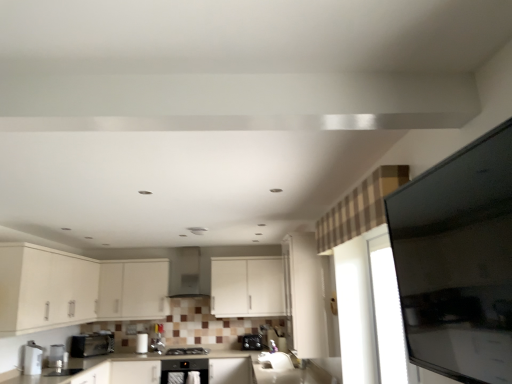
Question: Can you confirm if satin black oven at center, placed as the second home appliance when sorted from top to bottom, is smaller than metallic silver toaster at lower left, the 2th appliance positioned from the left?

Choices:
 (A) yes
 (B) no

Answer: (B)

Question: Considering the relative positions of satin black oven at center, which is the first home appliance in bottom-to-top order, and metallic silver toaster at lower left, positioned as the 4th appliance in back-to-front order, in the image provided, is satin black oven at center, which is the first home appliance in bottom-to-top order, behind metallic silver toaster at lower left, positioned as the 4th appliance in back-to-front order,?

Choices:
 (A) no
 (B) yes

Answer: (B)

Question: Is satin black oven at center, which is the first home appliance from right to left, aimed at metallic silver toaster at lower left, the 4th appliance viewed from the right?

Choices:
 (A) no
 (B) yes

Answer: (A)

Question: Can you confirm if satin black oven at center, placed as the second home appliance when sorted from top to bottom, is wider than metallic silver toaster at lower left, the 2th appliance positioned from the left?

Choices:
 (A) yes
 (B) no

Answer: (A)

Question: From a real-world perspective, is satin black oven at center, which is the first home appliance in bottom-to-top order, positioned under metallic silver toaster at lower left, positioned as the 4th appliance in back-to-front order, based on gravity?

Choices:
 (A) no
 (B) yes

Answer: (B)

Question: From a real-world perspective, is satin black stove at center physically located above or below metallic silver toaster at lower left, marked as the 2th appliance in a front-to-back arrangement?

Choices:
 (A) below
 (B) above

Answer: (A)

Question: Does point (195, 347) appear closer or farther from the camera than point (65, 360)?

Choices:
 (A) closer
 (B) farther

Answer: (B)

Question: Is satin black stove at center wider or thinner than metallic silver toaster at lower left, positioned as the 4th appliance in back-to-front order?

Choices:
 (A) wide
 (B) thin

Answer: (A)

Question: In terms of height, does satin black stove at center look taller or shorter compared to metallic silver toaster at lower left, the 2th appliance positioned from the left?

Choices:
 (A) tall
 (B) short

Answer: (B)

Question: Do you think matte white cabinet at center, which is the second cabinetry from left to right, is within satin silver toaster at center, which is the 1th appliance in right-to-left order, or outside of it?

Choices:
 (A) outside
 (B) inside

Answer: (A)

Question: Considering the positions of point (159, 266) and point (266, 337), is point (159, 266) closer or farther from the camera than point (266, 337)?

Choices:
 (A) closer
 (B) farther

Answer: (B)

Question: In terms of height, does matte white cabinet at center, which is the second cabinetry from left to right, look taller or shorter compared to satin silver toaster at center, which is the first appliance from back to front?

Choices:
 (A) short
 (B) tall

Answer: (B)

Question: Based on their sizes in the image, would you say matte white cabinet at center, which is the second cabinetry from left to right, is bigger or smaller than satin silver toaster at center, the fifth appliance from the left?

Choices:
 (A) small
 (B) big

Answer: (B)

Question: Based on their sizes in the image, would you say white glossy toaster at lower center, arranged as the third appliance when viewed from the back, is bigger or smaller than satin black toaster at lower center, marked as the fourth appliance in a front-to-back arrangement?

Choices:
 (A) big
 (B) small

Answer: (B)

Question: From a real-world perspective, is white glossy toaster at lower center, marked as the 3th appliance in a right-to-left arrangement, above or below satin black toaster at lower center, which is the 2th appliance from right to left?

Choices:
 (A) above
 (B) below

Answer: (A)